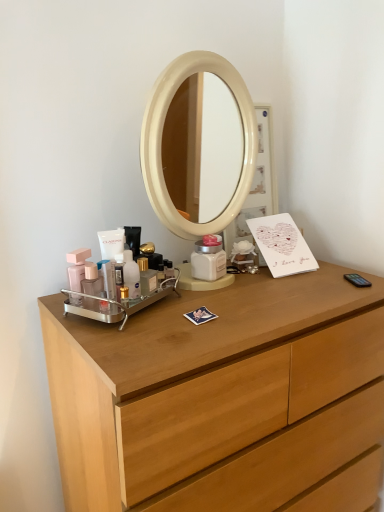
I want to click on vacant area in front of matte pink plastic at left, marked as the fourth toiletry in a right-to-left arrangement, so click(x=107, y=335).